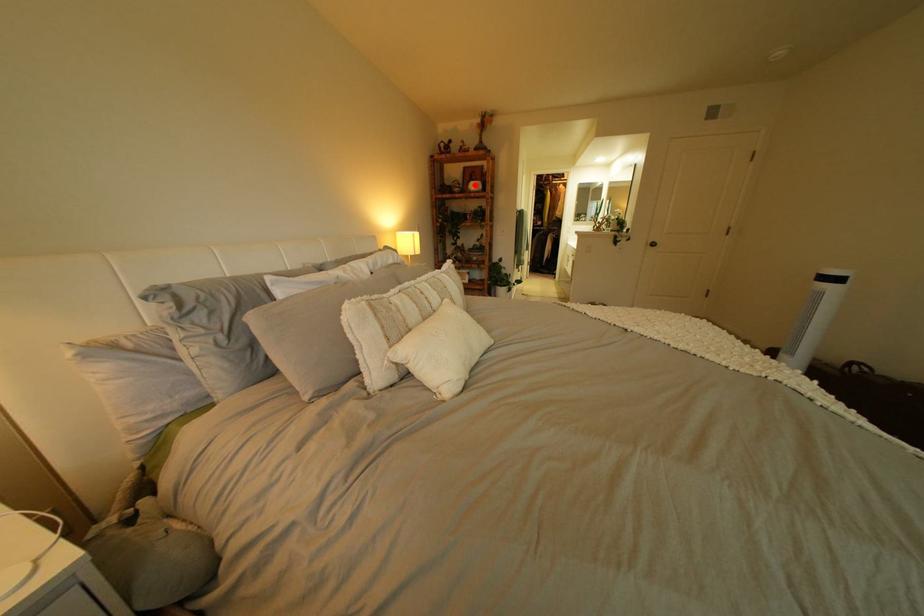
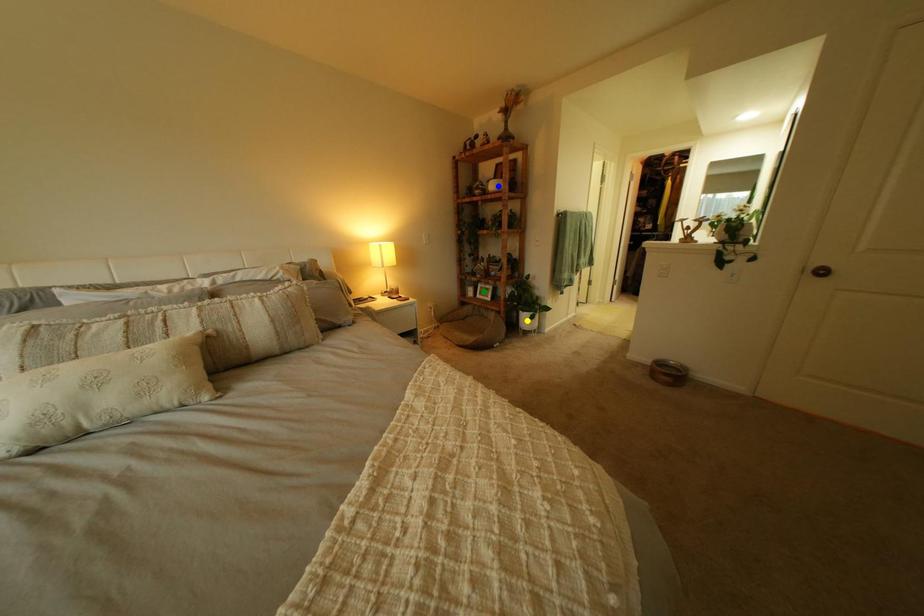
Question: I am providing you with two images of the same scene from different viewpoints. A red point is marked on the first image. You are given multiple points on the second image. In image 2, which mark is for the same physical point as the one in image 1?

Choices:
 (A) blue point
 (B) green point
 (C) yellow point

Answer: (A)